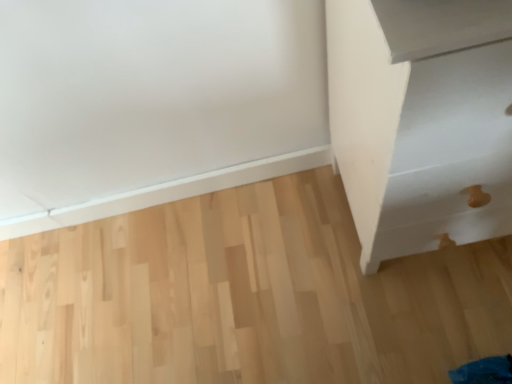
Question: Is white matte drawer at right thinner than natural wood floor at center?

Choices:
 (A) yes
 (B) no

Answer: (A)

Question: Does white matte drawer at right touch natural wood floor at center?

Choices:
 (A) no
 (B) yes

Answer: (A)

Question: Could you tell me if white matte drawer at right is turned towards natural wood floor at center?

Choices:
 (A) yes
 (B) no

Answer: (B)

Question: From a real-world perspective, is white matte drawer at right over natural wood floor at center?

Choices:
 (A) no
 (B) yes

Answer: (B)

Question: Is white matte drawer at right completely or partially outside of natural wood floor at center?

Choices:
 (A) yes
 (B) no

Answer: (A)

Question: From a real-world perspective, is white matte drawer at right positioned under natural wood floor at center based on gravity?

Choices:
 (A) no
 (B) yes

Answer: (A)

Question: Is the depth of natural wood floor at center less than that of white matte drawer at right?

Choices:
 (A) yes
 (B) no

Answer: (B)

Question: Could white matte drawer at right be considered to be inside natural wood floor at center?

Choices:
 (A) no
 (B) yes

Answer: (A)

Question: Considering the relative positions of natural wood floor at center and white matte drawer at right in the image provided, is natural wood floor at center to the right of white matte drawer at right from the viewer's perspective?

Choices:
 (A) yes
 (B) no

Answer: (B)

Question: From a real-world perspective, is natural wood floor at center under white matte drawer at right?

Choices:
 (A) yes
 (B) no

Answer: (A)

Question: From the image's perspective, is natural wood floor at center over white matte drawer at right?

Choices:
 (A) no
 (B) yes

Answer: (A)

Question: Could you tell me if natural wood floor at center is turned towards white matte drawer at right?

Choices:
 (A) no
 (B) yes

Answer: (A)

Question: Is white matte drawer at right wider or thinner than natural wood floor at center?

Choices:
 (A) thin
 (B) wide

Answer: (A)